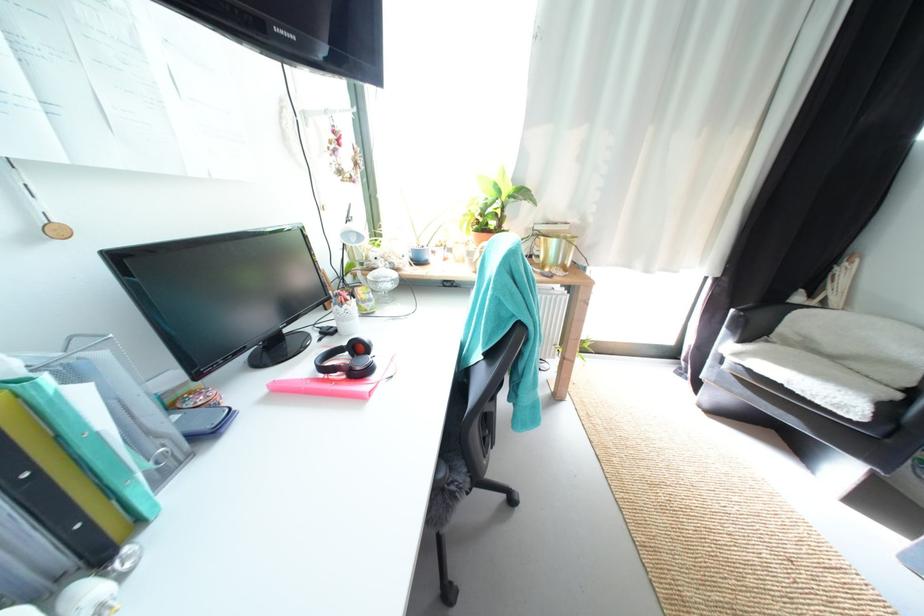
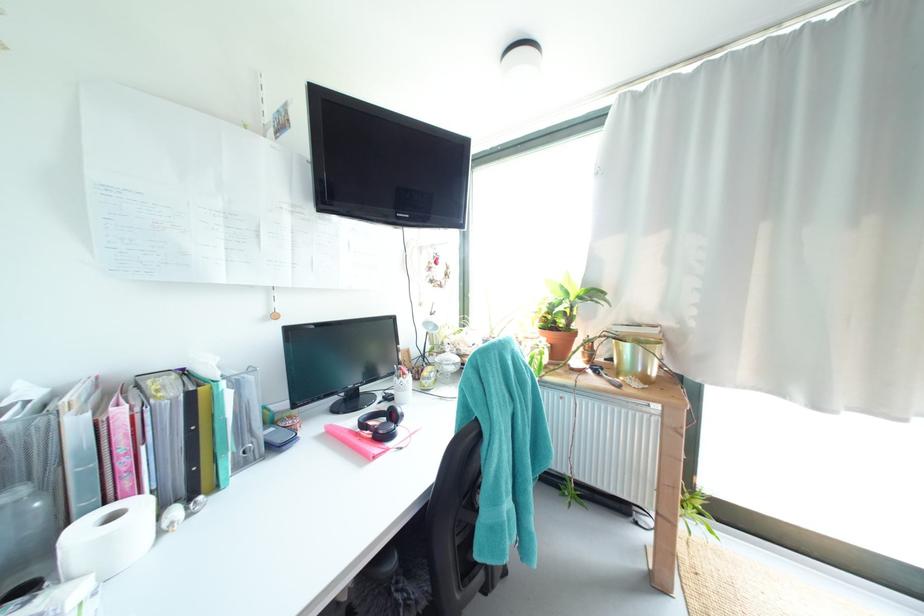
Find the pixel in the second image that matches point (108, 357) in the first image.

(259, 379)